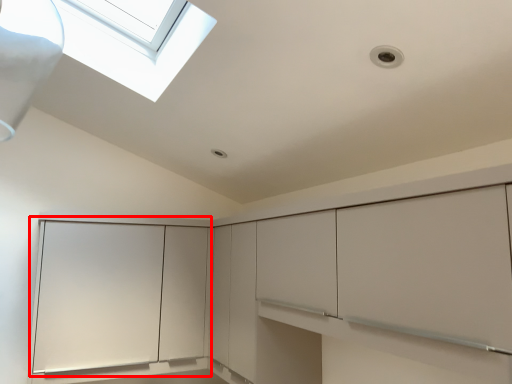
Question: From the image, what is the correct spatial relationship of glass door (annotated by the red box) in relation to cabinetry?

Choices:
 (A) right
 (B) left

Answer: (B)